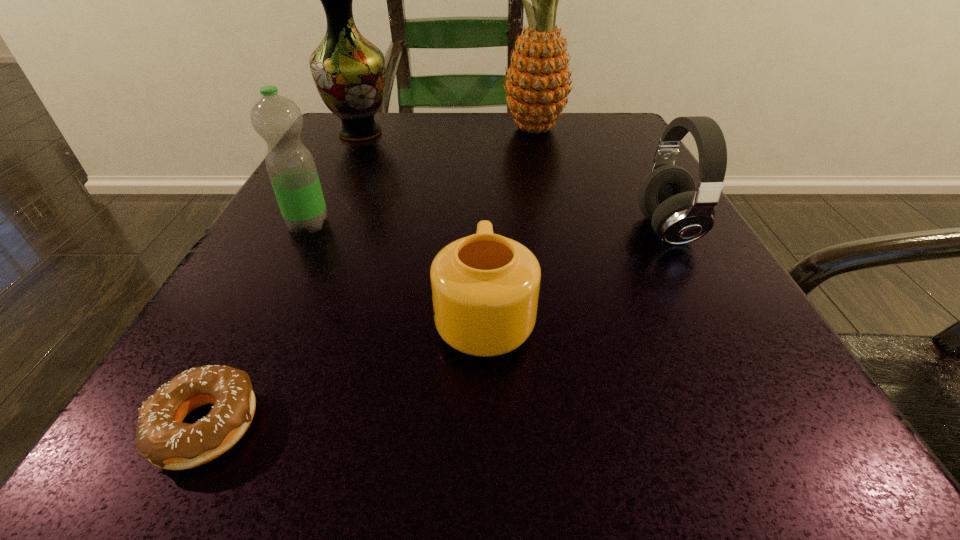
This screenshot has width=960, height=540. I want to click on blank area in the image that satisfies the following two spatial constraints: 1. on the back side of the pineapple; 2. on the left side of the vase, so click(363, 129).

At what (x,y) coordinates should I click in order to perform the action: click on free point that satisfies the following two spatial constraints: 1. on the back side of the tallest object; 2. on the right side of the water bottle. Please return your answer as a coordinate pair (x, y). The height and width of the screenshot is (540, 960). Looking at the image, I should click on tap(358, 129).